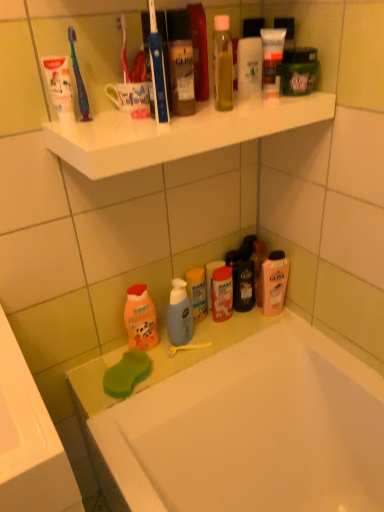
Identify the location of free space to the left of green sponge at lower left. (89, 382).